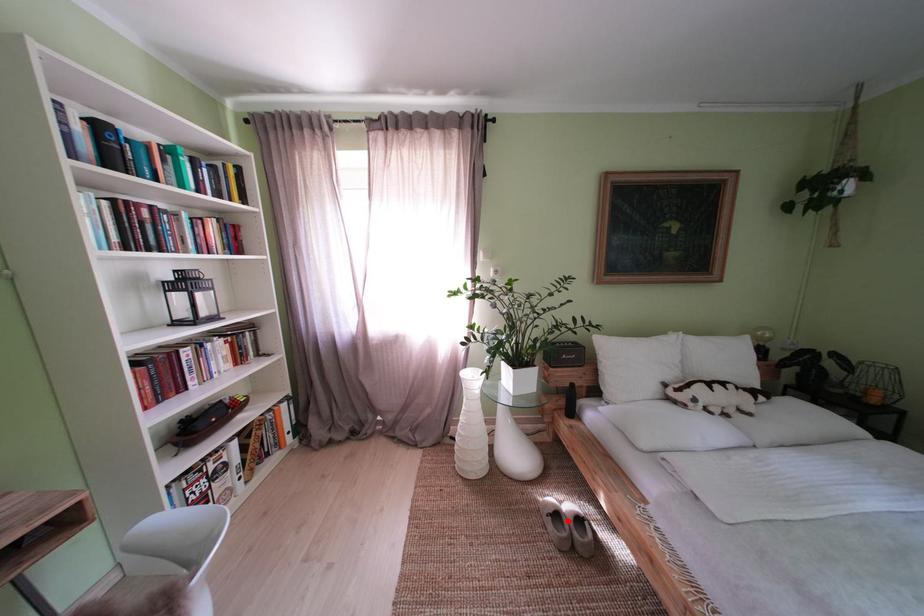
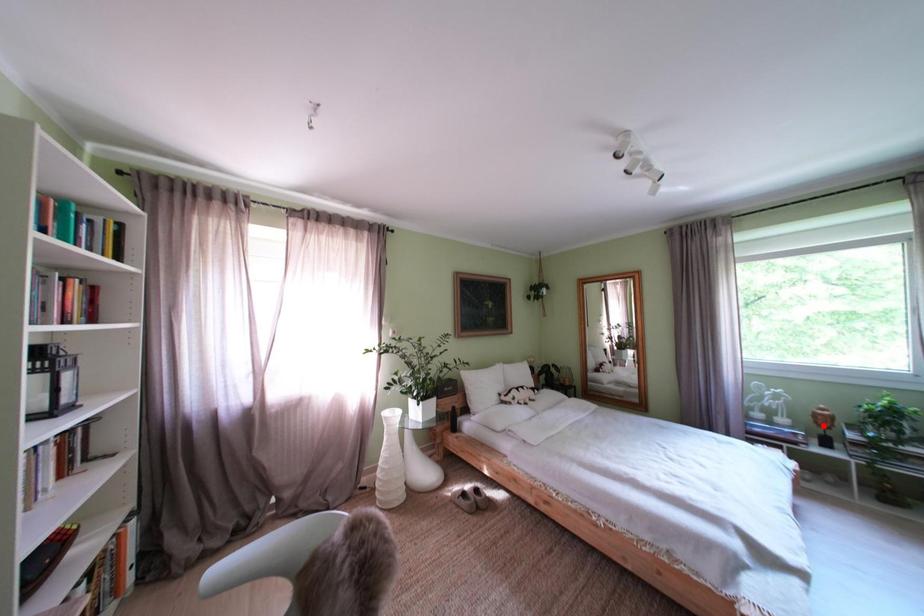
I am providing you with two images of the same scene from different viewpoints. A red point is marked on the first image and another point is marked on the second image. Do the highlighted points in image1 and image2 indicate the same real-world spot?

No